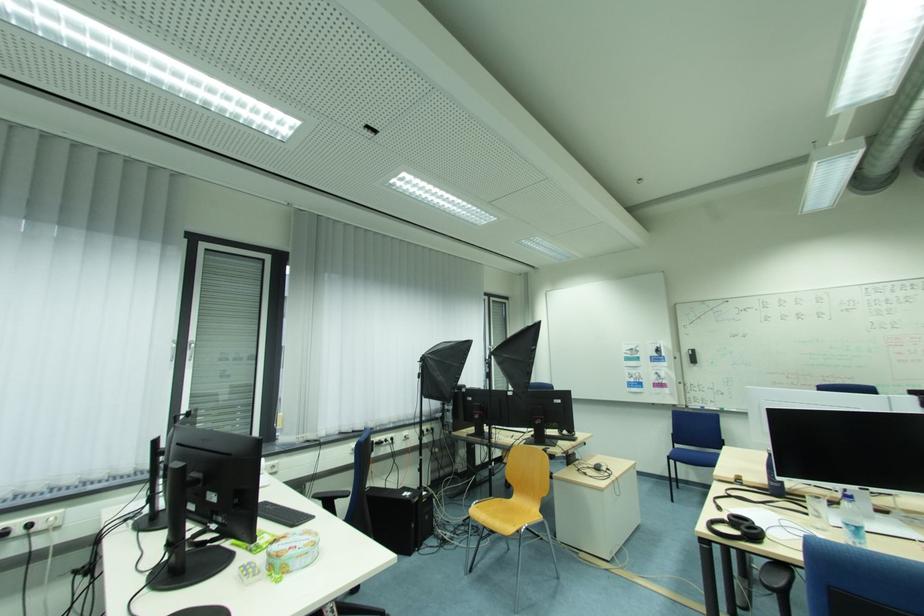
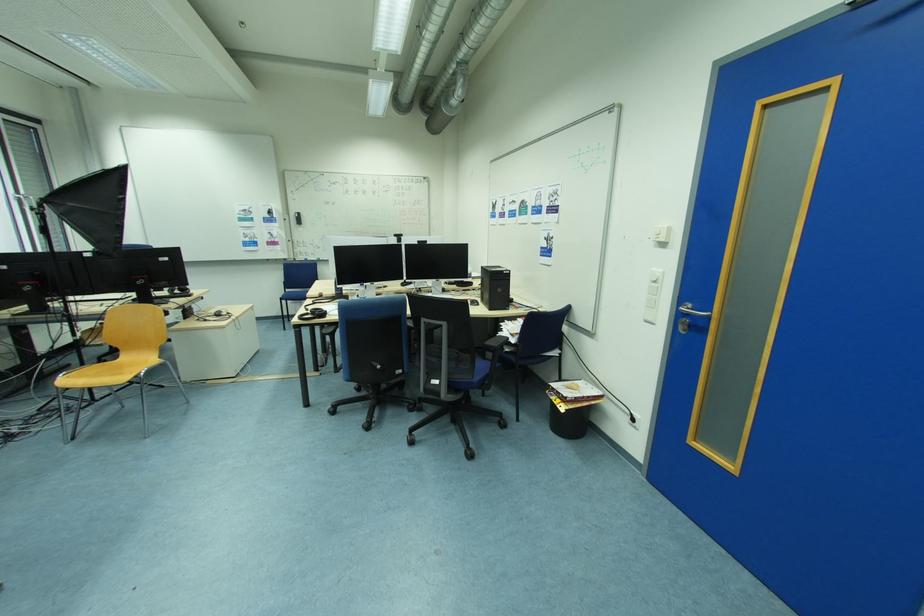
Where in the second image is the point corresponding to the point at 726,509 from the first image?

(313, 310)